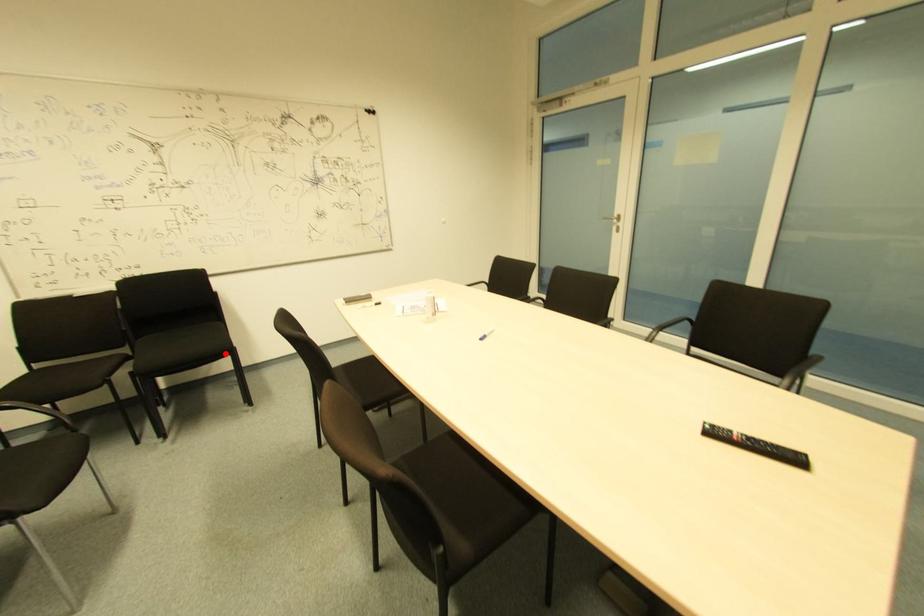
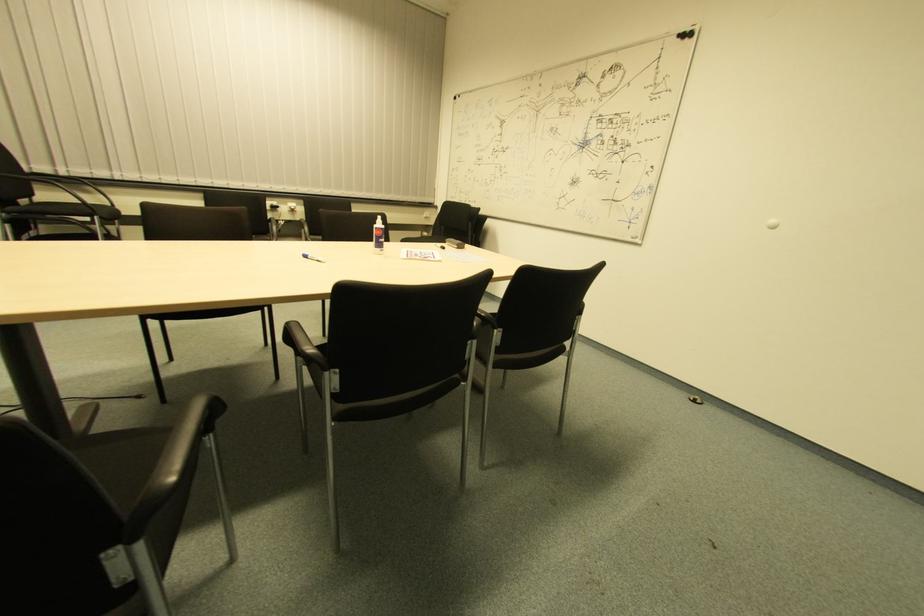
Question: I am providing you with two images of the same scene from different viewpoints. A red point is marked on the first image. Is the red point's position out of view in image 2?

Choices:
 (A) Yes
 (B) No

Answer: (A)